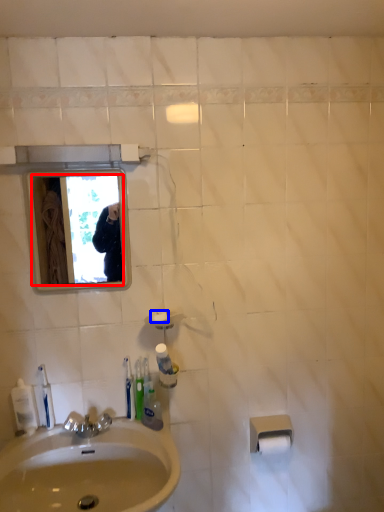
Question: Which of the following is the closest to the observer, mirror (highlighted by a red box) or soap (highlighted by a blue box)?

Choices:
 (A) mirror
 (B) soap

Answer: (A)